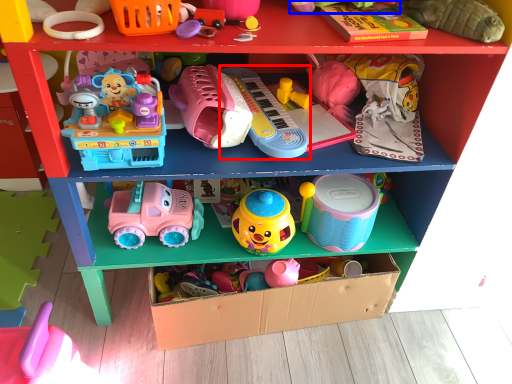
Question: Which object appears farthest to the camera in this image, toy (highlighted by a red box) or toy (highlighted by a blue box)?

Choices:
 (A) toy
 (B) toy

Answer: (A)